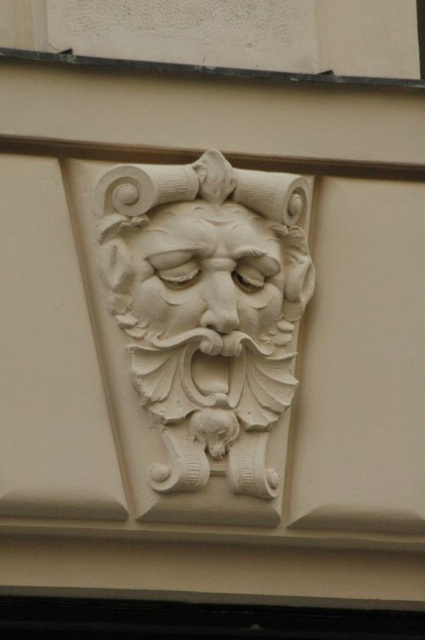
Question: In this image, where is white stone mask at center located relative to white stone face at center?

Choices:
 (A) right
 (B) left

Answer: (A)

Question: Is white stone mask at center smaller than white stone face at center?

Choices:
 (A) no
 (B) yes

Answer: (A)

Question: Among these objects, which one is farthest from the camera?

Choices:
 (A) white stone mask at center
 (B) white stone face at center

Answer: (B)

Question: Does white stone mask at center have a larger size compared to white stone face at center?

Choices:
 (A) no
 (B) yes

Answer: (B)